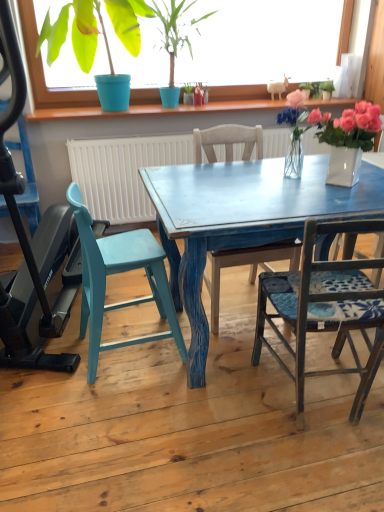
Question: Considering the relative sizes of green matte plant at upper left, the 1th houseplant from the left, and translucent glass vase at center in the image provided, is green matte plant at upper left, the 1th houseplant from the left, wider than translucent glass vase at center?

Choices:
 (A) yes
 (B) no

Answer: (A)

Question: Is green matte plant at upper left, which is counted as the second houseplant, starting from the right, looking in the opposite direction of translucent glass vase at center?

Choices:
 (A) yes
 (B) no

Answer: (B)

Question: Is the surface of green matte plant at upper left, which is counted as the second houseplant, starting from the right, in direct contact with translucent glass vase at center?

Choices:
 (A) yes
 (B) no

Answer: (B)

Question: From a real-world perspective, is green matte plant at upper left, the 1th houseplant from the left, located higher than translucent glass vase at center?

Choices:
 (A) no
 (B) yes

Answer: (B)

Question: Is green matte plant at upper left, the 1th houseplant from the left, not within translucent glass vase at center?

Choices:
 (A) no
 (B) yes

Answer: (B)

Question: Do you think wooden chair at center, which is the second chair in left-to-right order, is within green matte plant at upper left, which is counted as the second houseplant, starting from the right, or outside of it?

Choices:
 (A) inside
 (B) outside

Answer: (B)

Question: Based on their positions, is wooden chair at center, which is the second chair in left-to-right order, located to the left or right of green matte plant at upper left, which is counted as the second houseplant, starting from the right?

Choices:
 (A) right
 (B) left

Answer: (A)

Question: From a real-world perspective, is wooden chair at center, which is the second chair in left-to-right order, above or below green matte plant at upper left, which is counted as the second houseplant, starting from the right?

Choices:
 (A) below
 (B) above

Answer: (A)

Question: Is point (x=225, y=139) closer or farther from the camera than point (x=54, y=55)?

Choices:
 (A) closer
 (B) farther

Answer: (A)

Question: From a real-world perspective, is teal plastic baby carriage at left physically located above or below wooden chair at center, which is counted as the 2th chair, starting from the right?

Choices:
 (A) below
 (B) above

Answer: (B)

Question: In terms of height, does teal plastic baby carriage at left look taller or shorter compared to wooden chair at center, which is the second chair in left-to-right order?

Choices:
 (A) tall
 (B) short

Answer: (A)

Question: Is teal plastic baby carriage at left wider or thinner than wooden chair at center, which is counted as the 2th chair, starting from the right?

Choices:
 (A) wide
 (B) thin

Answer: (A)

Question: Considering their positions, is teal plastic baby carriage at left located in front of or behind wooden chair at center, which is the second chair in left-to-right order?

Choices:
 (A) behind
 (B) front

Answer: (B)

Question: Is point (296, 96) positioned closer to the camera than point (87, 219)?

Choices:
 (A) closer
 (B) farther

Answer: (B)

Question: Considering their positions, is translucent glass vase at center located in front of or behind teal painted wood chair at left, which is counted as the third chair, starting from the right?

Choices:
 (A) front
 (B) behind

Answer: (B)